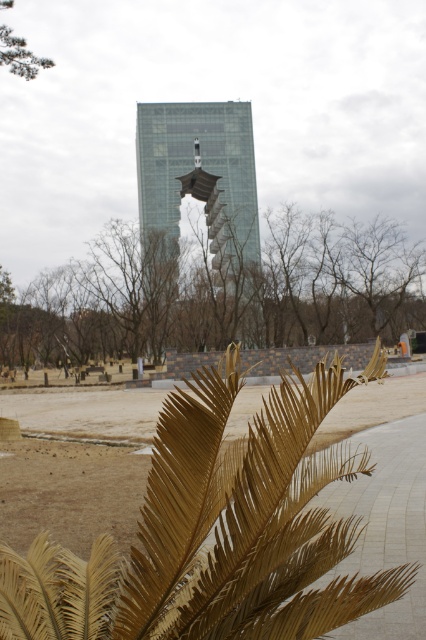
Measure the distance between point (100,596) and camera.

The distance of point (100,596) from camera is 10.26 feet.

Is gold textured palm leaf at lower center bigger than green leafy tree at upper left?

No, gold textured palm leaf at lower center is not bigger than green leafy tree at upper left.

Where is `gold textured palm leaf at lower center`? gold textured palm leaf at lower center is located at coordinates (215, 529).

Is brown leafy branch at center to the right of green leafy tree at upper left from the viewer's perspective?

Yes, brown leafy branch at center is to the right of green leafy tree at upper left.

Who is positioned more to the left, brown leafy branch at center or green leafy tree at upper left?

From the viewer's perspective, green leafy tree at upper left appears more on the left side.

You are a GUI agent. You are given a task and a screenshot of the screen. Output one action in this format:
    pyautogui.click(x=<x>, y=<y>)
    Task: Click on the brown leafy branch at center
    The image size is (426, 640).
    Given the screenshot: What is the action you would take?
    pyautogui.click(x=218, y=294)

This screenshot has width=426, height=640. Identify the location of brown leafy branch at center. (218, 294).

Between transparent glass tower at center and green leafy tree at upper left, which one is positioned higher?

transparent glass tower at center

Between point (175, 237) and point (0, 65), which one is positioned behind?

The point (175, 237) is more distant.

In order to click on transparent glass tower at center in this screenshot , I will do `click(206, 195)`.

You are a GUI agent. You are given a task and a screenshot of the screen. Output one action in this format:
    pyautogui.click(x=<x>, y=<y>)
    Task: Click on the transparent glass tower at center
    
    Given the screenshot: What is the action you would take?
    pyautogui.click(x=206, y=195)